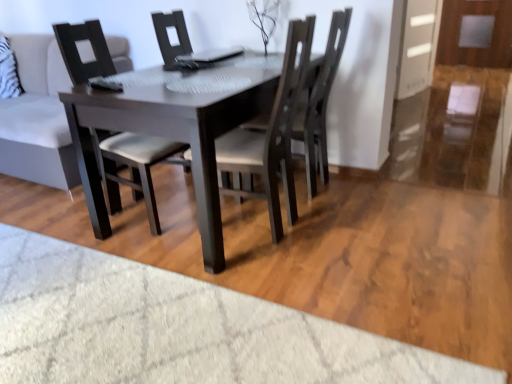
Consider the image. Measure the distance between dark brown wood table at center and camera.

A distance of 5.24 feet exists between dark brown wood table at center and camera.

What are the coordinates of `dark brown wood table at center` in the screenshot? It's located at (168, 137).

Consider the image. How much space does dark wood chair at center, which is counted as the second chair, starting from the left, occupy vertically?

dark wood chair at center, which is counted as the second chair, starting from the left, is 3.48 feet tall.

This screenshot has width=512, height=384. Describe the element at coordinates (132, 167) in the screenshot. I see `matte black chair at center, the 3th chair in the right-to-left sequence` at that location.

Find the location of a particular element. Image resolution: width=512 pixels, height=384 pixels. dark wood chair at center, which ranks as the 1th chair in right-to-left order is located at coordinates (322, 102).

This screenshot has height=384, width=512. Describe the element at coordinates (322, 102) in the screenshot. I see `dark wood chair at center, which is counted as the 3th chair, starting from the left` at that location.

The image size is (512, 384). In order to click on dark brown wood table at center in this screenshot , I will do `click(168, 137)`.

How different are the orientations of dark wood chair at center, which ranks as the 1th chair in right-to-left order, and matte black chair at center, the 3th chair in the right-to-left sequence, in degrees?

The angular difference between dark wood chair at center, which ranks as the 1th chair in right-to-left order, and matte black chair at center, the 3th chair in the right-to-left sequence, is 178 degrees.

Is dark wood chair at center, which is counted as the 3th chair, starting from the left, situated inside matte black chair at center, the 3th chair in the right-to-left sequence, or outside?

dark wood chair at center, which is counted as the 3th chair, starting from the left, is not enclosed by matte black chair at center, the 3th chair in the right-to-left sequence.

Locate an element on the screen. The image size is (512, 384). the 1st chair below the dark wood chair at center, which is counted as the 3th chair, starting from the left (from the image's perspective) is located at coordinates (132, 167).

Is matte black chair at center, which is the 1th chair from left to right, in front of or behind dark brown wood table at center in the image?

In the image, matte black chair at center, which is the 1th chair from left to right, appears behind dark brown wood table at center.

From the image's perspective, who appears lower, matte black chair at center, which is the 1th chair from left to right, or dark brown wood table at center?

dark brown wood table at center, from the image's perspective.

Is point (80, 83) behind point (121, 101)?

Yes, point (80, 83) is farther from viewer.

Are dark wood chair at center, which is counted as the second chair, starting from the right, and transparent glass door at right making contact?

No.

Can you confirm if dark wood chair at center, which is counted as the second chair, starting from the right, is bigger than transparent glass door at right?

Yes.

Is dark wood chair at center, which is counted as the second chair, starting from the right, looking in the opposite direction of transparent glass door at right?

That's not correct — dark wood chair at center, which is counted as the second chair, starting from the right, is not looking away from transparent glass door at right.

How different are the orientations of dark wood chair at center, which is counted as the second chair, starting from the right, and transparent glass door at right in degrees?

The facing directions of dark wood chair at center, which is counted as the second chair, starting from the right, and transparent glass door at right are 171 degrees apart.

Is there a large distance between dark wood chair at center, which ranks as the 1th chair in right-to-left order, and dark wood chair at center, which is counted as the second chair, starting from the right?

No, dark wood chair at center, which ranks as the 1th chair in right-to-left order, is not far from dark wood chair at center, which is counted as the second chair, starting from the right.

From the image's perspective, starting from the dark wood chair at center, which is counted as the 3th chair, starting from the left, which chair is the 2nd one below? Please provide its 2D coordinates.

[(270, 136)]

Based on the photo, from a real-world perspective, is dark wood chair at center, which is counted as the 3th chair, starting from the left, on top of dark wood chair at center, which is counted as the second chair, starting from the left?

No, from a real-world perspective, dark wood chair at center, which is counted as the 3th chair, starting from the left, is not over dark wood chair at center, which is counted as the second chair, starting from the left

In terms of height, does dark wood chair at center, which ranks as the 1th chair in right-to-left order, look taller or shorter compared to dark wood chair at center, which is counted as the second chair, starting from the right?

Considering their sizes, dark wood chair at center, which ranks as the 1th chair in right-to-left order, has less height than dark wood chair at center, which is counted as the second chair, starting from the right.

Which is more distant, (x=259, y=78) or (x=291, y=41)?

The point (x=259, y=78) is more distant.

Is dark brown wood table at center to the left of dark wood chair at center, which is counted as the second chair, starting from the left, from the viewer's perspective?

Yes, dark brown wood table at center is to the left of dark wood chair at center, which is counted as the second chair, starting from the left.

Who is smaller, dark brown wood table at center or dark wood chair at center, which is counted as the second chair, starting from the right?

With smaller size is dark wood chair at center, which is counted as the second chair, starting from the right.

Is dark brown wood table at center further to camera compared to dark wood chair at center, which is counted as the second chair, starting from the right?

No.

Which of these two, light gray fabric couch at upper left or dark brown wood table at center, stands shorter?

Standing shorter between the two is dark brown wood table at center.

Considering the relative positions of light gray fabric couch at upper left and dark brown wood table at center in the image provided, is light gray fabric couch at upper left to the left of dark brown wood table at center from the viewer's perspective?

Indeed, light gray fabric couch at upper left is positioned on the left side of dark brown wood table at center.

Which of these two, light gray fabric couch at upper left or dark brown wood table at center, is thinner?

dark brown wood table at center is thinner.

Considering their positions, is light gray fabric couch at upper left located in front of or behind dark wood chair at center, which is counted as the second chair, starting from the left?

light gray fabric couch at upper left is positioned farther from the viewer than dark wood chair at center, which is counted as the second chair, starting from the left.

Can dark wood chair at center, which is counted as the second chair, starting from the right, be found inside light gray fabric couch at upper left?

That's incorrect, dark wood chair at center, which is counted as the second chair, starting from the right, is not inside light gray fabric couch at upper left.

From the image's perspective, is light gray fabric couch at upper left over dark wood chair at center, which is counted as the second chair, starting from the left?

Yes, from the image's perspective, light gray fabric couch at upper left is above dark wood chair at center, which is counted as the second chair, starting from the left.

How different are the orientations of light gray fabric couch at upper left and dark wood chair at center, which is counted as the second chair, starting from the left, in degrees?

84.5 degrees.

Where is `the 1st chair above the matte black chair at center, which is the 1th chair from left to right (from a real-world perspective)`? the 1st chair above the matte black chair at center, which is the 1th chair from left to right (from a real-world perspective) is located at coordinates (322, 102).

The image size is (512, 384). I want to click on chair that is on the left side of dark brown wood table at center, so (x=132, y=167).

Estimate the real-world distances between objects in this image. Which object is closer to dark brown wood table at center, light gray fabric couch at upper left or dark wood chair at center, which is counted as the 3th chair, starting from the left?

Among the two, dark wood chair at center, which is counted as the 3th chair, starting from the left, is located nearer to dark brown wood table at center.

Which object lies nearer to the anchor point light gray fabric couch at upper left, transparent glass door at right or dark brown wood table at center?

dark brown wood table at center is positioned closer to the anchor light gray fabric couch at upper left.

Which object lies nearer to the anchor point dark wood chair at center, which is counted as the 3th chair, starting from the left, light gray fabric couch at upper left or matte black chair at center, the 3th chair in the right-to-left sequence?

matte black chair at center, the 3th chair in the right-to-left sequence, lies closer to dark wood chair at center, which is counted as the 3th chair, starting from the left, than the other object.

Considering their positions, is light gray fabric couch at upper left positioned closer to matte black chair at center, the 3th chair in the right-to-left sequence, than dark brown wood table at center?

dark brown wood table at center is positioned closer to the anchor matte black chair at center, the 3th chair in the right-to-left sequence.

Based on their spatial positions, is dark wood chair at center, which ranks as the 1th chair in right-to-left order, or transparent glass door at right closer to matte black chair at center, the 3th chair in the right-to-left sequence?

Among the two, dark wood chair at center, which ranks as the 1th chair in right-to-left order, is located nearer to matte black chair at center, the 3th chair in the right-to-left sequence.

Which object lies nearer to the anchor point matte black chair at center, the 3th chair in the right-to-left sequence, dark wood chair at center, which is counted as the second chair, starting from the left, or dark brown wood table at center?

Among the two, dark brown wood table at center is located nearer to matte black chair at center, the 3th chair in the right-to-left sequence.

From the image, which object appears to be nearer to dark wood chair at center, which is counted as the second chair, starting from the right, light gray fabric couch at upper left or dark brown wood table at center?

The object closer to dark wood chair at center, which is counted as the second chair, starting from the right, is dark brown wood table at center.

From the picture: Estimate the real-world distances between objects in this image. Which object is closer to matte black chair at center, which is the 1th chair from left to right, dark brown wood table at center or light gray fabric couch at upper left?

The object closer to matte black chair at center, which is the 1th chair from left to right, is dark brown wood table at center.

This screenshot has height=384, width=512. In order to click on kitchen & dining room table between matte black chair at center, the 3th chair in the right-to-left sequence, and dark wood chair at center, which is counted as the 3th chair, starting from the left, in the horizontal direction in this screenshot , I will do `click(168, 137)`.

Identify the location of chair between matte black chair at center, which is the 1th chair from left to right, and transparent glass door at right in the front-back direction. (322, 102).

This screenshot has height=384, width=512. I want to click on kitchen & dining room table between light gray fabric couch at upper left and dark wood chair at center, which is counted as the 3th chair, starting from the left, so click(x=168, y=137).

The width and height of the screenshot is (512, 384). In order to click on chair between matte black chair at center, the 3th chair in the right-to-left sequence, and dark wood chair at center, which is counted as the 3th chair, starting from the left, in the horizontal direction in this screenshot , I will do `click(270, 136)`.